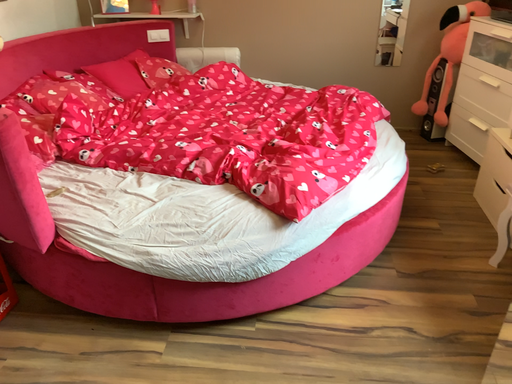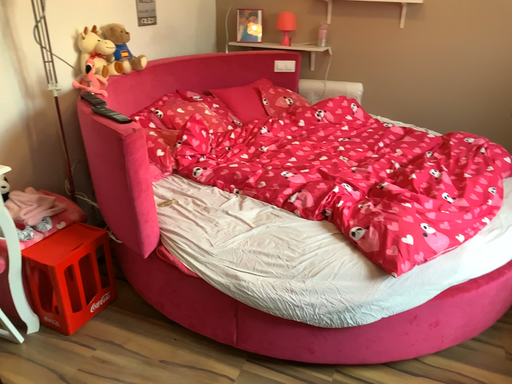
Question: How did the camera likely rotate when shooting the video?

Choices:
 (A) rotated left
 (B) rotated right

Answer: (A)